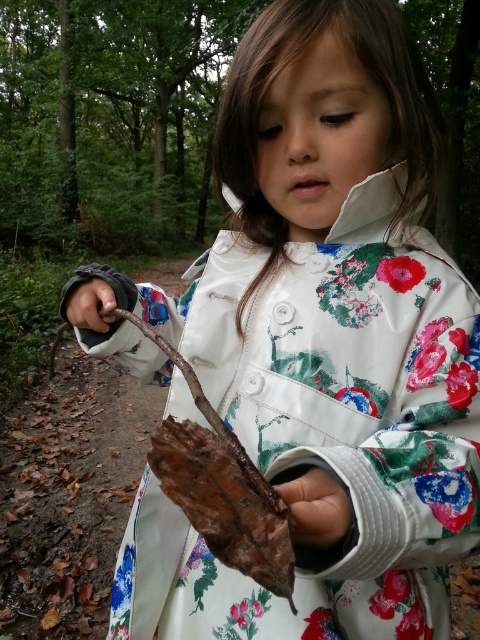
Question: Which of the following is the closest to the observer?

Choices:
 (A) dark brown leather hand at lower left
 (B) brown rough leaf at lower center

Answer: (B)

Question: Considering the relative positions of brown rough leaf at lower center and dark brown leather hand at lower left in the image provided, where is brown rough leaf at lower center located with respect to dark brown leather hand at lower left?

Choices:
 (A) left
 (B) right

Answer: (B)

Question: Considering the relative positions of brown rough leaf at lower center and dark brown leather hand at lower left in the image provided, where is brown rough leaf at lower center located with respect to dark brown leather hand at lower left?

Choices:
 (A) above
 (B) below

Answer: (B)

Question: Can you confirm if brown rough leaf at lower center is wider than dark brown leather hand at lower left?

Choices:
 (A) yes
 (B) no

Answer: (B)